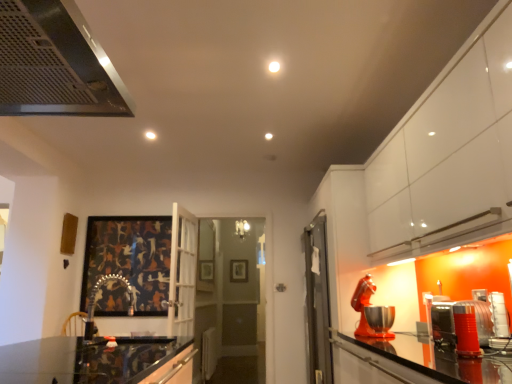
What do you see at coordinates (454, 324) in the screenshot?
I see `metallic silver toaster at lower right, the second appliance positioned from the front` at bounding box center [454, 324].

At what (x,y) coordinates should I click in order to perform the action: click on wooden picture frame at center, the first picture frame when ordered from back to front. Please return your answer as a coordinate pair (x, y). The height and width of the screenshot is (384, 512). Looking at the image, I should click on (239, 271).

What do you see at coordinates (239, 271) in the screenshot?
I see `wooden picture frame at center, the first picture frame when ordered from back to front` at bounding box center [239, 271].

In order to face metallic mesh at upper left, should I rotate leftwards or rightwards?

Rotate your view left by about 28.623°.

The image size is (512, 384). What do you see at coordinates (367, 306) in the screenshot?
I see `shiny metallic mixer at right, marked as the third appliance in a front-to-back arrangement` at bounding box center [367, 306].

What is the approximate height of shiny metallic mixer at right, marked as the third appliance in a front-to-back arrangement?

The height of shiny metallic mixer at right, marked as the third appliance in a front-to-back arrangement, is 16.01 inches.

Find the location of a particular element. dark matte painting at center, which appears as the 2th picture frame when ordered from the bottom is located at coordinates (130, 258).

Is wooden picture frame at center, which is the first picture frame from right to left, taller than metallic mesh at upper left?

No, wooden picture frame at center, which is the first picture frame from right to left, is not taller than metallic mesh at upper left.

Between wooden picture frame at center, acting as the second picture frame starting from the front, and metallic mesh at upper left, which one has larger width?

metallic mesh at upper left is wider.

Is wooden picture frame at center, which appears as the 2th picture frame when viewed from the left, closer to camera compared to metallic mesh at upper left?

No, wooden picture frame at center, which appears as the 2th picture frame when viewed from the left, is behind metallic mesh at upper left.

Is wooden picture frame at center, placed as the 1th picture frame when sorted from bottom to top, aimed at metallic mesh at upper left?

Yes, wooden picture frame at center, placed as the 1th picture frame when sorted from bottom to top, is facing metallic mesh at upper left.

Can you confirm if metallic silver toaster at lower right, acting as the third appliance starting from the back, is shorter than shiny metallic mixer at right, placed as the second appliance when sorted from back to front?

Yes.

From a real-world perspective, who is located higher, metallic silver toaster at lower right, the second appliance positioned from the front, or shiny metallic mixer at right, placed as the second appliance when sorted from back to front?

shiny metallic mixer at right, placed as the second appliance when sorted from back to front.

Where is `appliance that is the 1st one when counting downward from the metallic silver toaster at lower right, the second appliance positioned from the front (from the image's perspective)`? The height and width of the screenshot is (384, 512). appliance that is the 1st one when counting downward from the metallic silver toaster at lower right, the second appliance positioned from the front (from the image's perspective) is located at coordinates (367, 306).

From the image's perspective, between metallic mesh at upper left and dark matte painting at center, the first picture frame when ordered from top to bottom, which one is located above?

metallic mesh at upper left appears higher in the image.

Is dark matte painting at center, the first picture frame when ordered from top to bottom, at the back of metallic mesh at upper left?

No, dark matte painting at center, the first picture frame when ordered from top to bottom, is not at the back of metallic mesh at upper left.

Is metallic mesh at upper left bigger or smaller than dark matte painting at center, which appears as the 1th picture frame when viewed from the left?

In the image, metallic mesh at upper left appears to be larger than dark matte painting at center, which appears as the 1th picture frame when viewed from the left.

Are metallic mesh at upper left and dark matte painting at center, the second picture frame from the back, beside each other?

metallic mesh at upper left and dark matte painting at center, the second picture frame from the back, are not in contact.

Would you say shiny metallic mixer at right, placed as the second appliance when sorted from back to front, is part of dark matte painting at center, which appears as the 1th picture frame when viewed from the left,'s contents?

No, dark matte painting at center, which appears as the 1th picture frame when viewed from the left, does not contain shiny metallic mixer at right, placed as the second appliance when sorted from back to front.

Which of these two, dark matte painting at center, which appears as the 1th picture frame when viewed from the left, or shiny metallic mixer at right, placed as the second appliance when sorted from back to front, is wider?

shiny metallic mixer at right, placed as the second appliance when sorted from back to front.

Is point (83, 275) in front of point (354, 308)?

That is False.

Is dark matte painting at center, the second picture frame from the back, to the left or to the right of shiny metallic mixer at right, placed as the second appliance when sorted from back to front, in the image?

dark matte painting at center, the second picture frame from the back, is positioned on shiny metallic mixer at right, placed as the second appliance when sorted from back to front,'s left side.

Would you say dark matte painting at center, acting as the 2th picture frame starting from the right, contains metallic mesh at upper left?

Actually, metallic mesh at upper left is outside dark matte painting at center, acting as the 2th picture frame starting from the right.

Is dark matte painting at center, positioned as the first picture frame in front-to-back order, turned away from metallic mesh at upper left?

dark matte painting at center, positioned as the first picture frame in front-to-back order, does not have its back to metallic mesh at upper left.

Between point (166, 265) and point (85, 25), which one is positioned in front?

The point (85, 25) is closer to the camera.

From the image's perspective, is dark matte painting at center, which appears as the 2th picture frame when ordered from the bottom, located beneath metallic mesh at upper left?

Indeed, from the image's perspective, dark matte painting at center, which appears as the 2th picture frame when ordered from the bottom, is shown beneath metallic mesh at upper left.

From a real-world perspective, between metallic silver toaster at right, placed as the fourth appliance when sorted from front to back, and metallic silver toaster at lower right, the second appliance positioned from the front, who is vertically higher?

metallic silver toaster at right, placed as the fourth appliance when sorted from front to back, is physically above.

From the image's perspective, would you say metallic silver toaster at right, placed as the fourth appliance when sorted from front to back, is shown under metallic silver toaster at lower right, the second appliance positioned from the front?

Yes, from the image's perspective, metallic silver toaster at right, placed as the fourth appliance when sorted from front to back, is below metallic silver toaster at lower right, the second appliance positioned from the front.

In terms of width, does metallic silver toaster at right, positioned as the 1th appliance in back-to-front order, look wider or thinner when compared to metallic silver toaster at lower right, acting as the third appliance starting from the back?

In the image, metallic silver toaster at right, positioned as the 1th appliance in back-to-front order, appears to be more narrow than metallic silver toaster at lower right, acting as the third appliance starting from the back.

Considering the sizes of metallic silver toaster at right, positioned as the 1th appliance in back-to-front order, and shiny metallic mixer at right, marked as the third appliance in a front-to-back arrangement, in the image, is metallic silver toaster at right, positioned as the 1th appliance in back-to-front order, taller or shorter than shiny metallic mixer at right, marked as the third appliance in a front-to-back arrangement,?

In the image, metallic silver toaster at right, positioned as the 1th appliance in back-to-front order, appears to be shorter than shiny metallic mixer at right, marked as the third appliance in a front-to-back arrangement.

Is metallic silver toaster at right, positioned as the 1th appliance in back-to-front order, smaller than shiny metallic mixer at right, placed as the second appliance when sorted from back to front?

Correct, metallic silver toaster at right, positioned as the 1th appliance in back-to-front order, occupies less space than shiny metallic mixer at right, placed as the second appliance when sorted from back to front.

Is metallic silver toaster at right, placed as the fourth appliance when sorted from front to back, not close to shiny metallic mixer at right, marked as the third appliance in a front-to-back arrangement?

No.

From a real-world perspective, does metallic silver toaster at right, placed as the fourth appliance when sorted from front to back, sit lower than shiny metallic mixer at right, marked as the third appliance in a front-to-back arrangement?

Yes, from a real-world perspective, metallic silver toaster at right, placed as the fourth appliance when sorted from front to back, is under shiny metallic mixer at right, marked as the third appliance in a front-to-back arrangement.

What are the coordinates of `exhaust hood that appears on the left of wooden picture frame at center, the first picture frame when ordered from back to front` in the screenshot? It's located at (55, 63).

Find the location of a particular element. The height and width of the screenshot is (384, 512). the 2nd appliance to the right of the shiny metallic mixer at right, marked as the third appliance in a front-to-back arrangement, counting from the anchor's position is located at coordinates (454, 324).

Based on their spatial positions, is dark matte painting at center, which appears as the 2th picture frame when ordered from the bottom, or shiny metallic mixer at right, placed as the second appliance when sorted from back to front, further from metallic mesh at upper left?

dark matte painting at center, which appears as the 2th picture frame when ordered from the bottom, is further to metallic mesh at upper left.

When comparing their distances from dark matte painting at center, the first picture frame when ordered from top to bottom, does rubberized orange blender at right, placed as the fourth appliance when sorted from back to front, or metallic mesh at upper left seem further?

rubberized orange blender at right, placed as the fourth appliance when sorted from back to front.

Which object lies further to the anchor point metallic silver toaster at right, positioned as the 1th appliance in back-to-front order, metallic silver toaster at lower right, acting as the third appliance starting from the back, or shiny metallic mixer at right, placed as the second appliance when sorted from back to front?

metallic silver toaster at lower right, acting as the third appliance starting from the back.

From the image, which object appears to be nearer to metallic mesh at upper left, metallic silver toaster at lower right, acting as the third appliance starting from the back, or rubberized orange blender at right, the first appliance positioned from the front?

Among the two, metallic silver toaster at lower right, acting as the third appliance starting from the back, is located nearer to metallic mesh at upper left.

Considering their positions, is metallic silver toaster at right, positioned as the 1th appliance in back-to-front order, positioned further to dark matte painting at center, positioned as the first picture frame in front-to-back order, than rubberized orange blender at right, placed as the fourth appliance when sorted from back to front?

The object further to dark matte painting at center, positioned as the first picture frame in front-to-back order, is rubberized orange blender at right, placed as the fourth appliance when sorted from back to front.

Considering their positions, is dark matte painting at center, the first picture frame when ordered from top to bottom, positioned closer to metallic silver toaster at right, positioned as the 1th appliance in back-to-front order, than shiny metallic mixer at right, placed as the second appliance when sorted from back to front?

shiny metallic mixer at right, placed as the second appliance when sorted from back to front, is closer to metallic silver toaster at right, positioned as the 1th appliance in back-to-front order.

Considering their positions, is dark matte painting at center, positioned as the first picture frame in front-to-back order, positioned further to rubberized orange blender at right, placed as the fourth appliance when sorted from back to front, than wooden picture frame at center, which appears as the 2th picture frame when viewed from the left?

wooden picture frame at center, which appears as the 2th picture frame when viewed from the left, is further to rubberized orange blender at right, placed as the fourth appliance when sorted from back to front.

Estimate the real-world distances between objects in this image. Which object is further from metallic mesh at upper left, metallic silver toaster at right, placed as the fourth appliance when sorted from front to back, or metallic silver toaster at lower right, the second appliance positioned from the front?

metallic silver toaster at right, placed as the fourth appliance when sorted from front to back, lies further to metallic mesh at upper left than the other object.

Where is `picture frame between shiny metallic mixer at right, marked as the third appliance in a front-to-back arrangement, and wooden picture frame at center, placed as the 1th picture frame when sorted from bottom to top, along the z-axis`? The width and height of the screenshot is (512, 384). picture frame between shiny metallic mixer at right, marked as the third appliance in a front-to-back arrangement, and wooden picture frame at center, placed as the 1th picture frame when sorted from bottom to top, along the z-axis is located at coordinates (130, 258).

I want to click on appliance between rubberized orange blender at right, the first appliance positioned from the front, and shiny metallic mixer at right, placed as the second appliance when sorted from back to front, along the z-axis, so click(454, 324).

You are a GUI agent. You are given a task and a screenshot of the screen. Output one action in this format:
    pyautogui.click(x=<x>, y=<y>)
    Task: Click on the picture frame positioned between metallic mesh at upper left and wooden picture frame at center, which is the first picture frame from right to left, from near to far
    This screenshot has height=384, width=512.
    Given the screenshot: What is the action you would take?
    pyautogui.click(x=130, y=258)

This screenshot has height=384, width=512. I want to click on picture frame between metallic silver toaster at right, placed as the fourth appliance when sorted from front to back, and wooden picture frame at center, acting as the second picture frame starting from the front, along the z-axis, so click(130, 258).